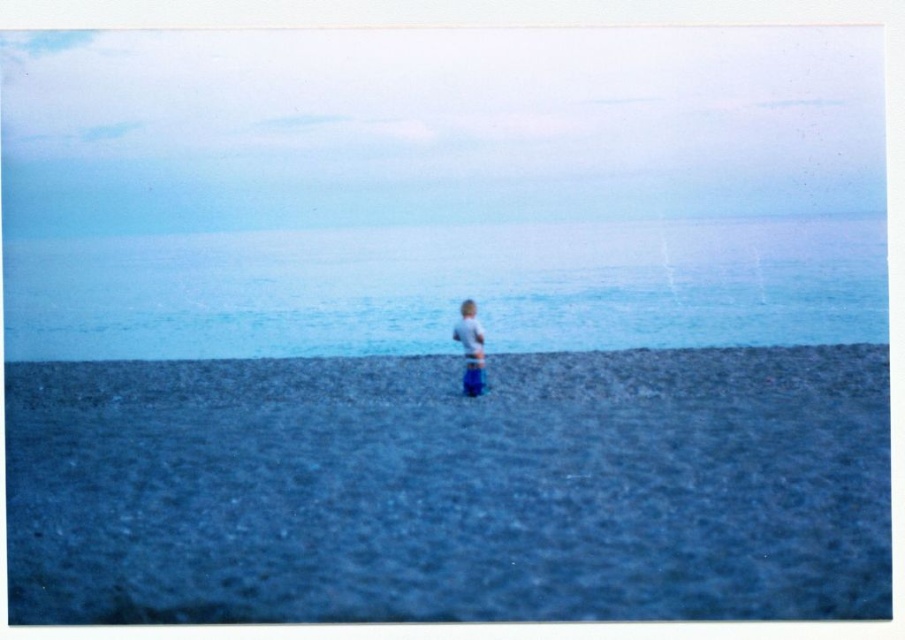
You are standing on the pebbled beach and notice the blue water at center and the white cotton shirt at center. Which object is wider from your perspective?

The blue water at center is wider than the white cotton shirt at center according to the description.

You are standing on the pebbled beach and see the blue water at center and the white cotton shirt at center. Which object is higher in the image?

The blue water at center is higher than the white cotton shirt at center in the image.